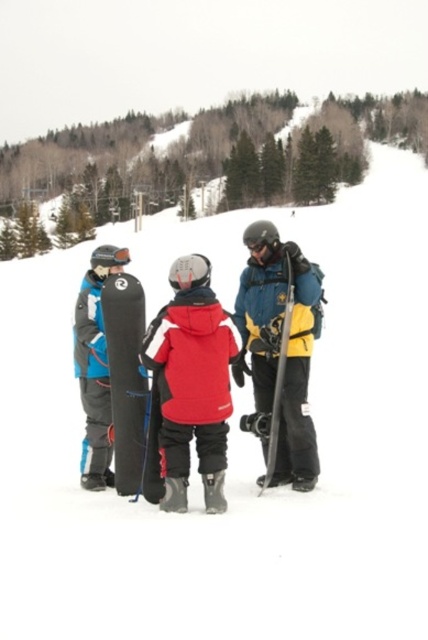
You are a photographer standing at the bottom of the slope. You want to capture a photo of the matte red jacket at center and the black matte snowboard at center. Based on their positions, which object should appear lower in the photo?

The matte red jacket at center is positioned under the black matte snowboard at center, so the matte red jacket at center will appear lower in the photo.

You are a photographer standing on the slope and want to capture both the matte blue snowboard at right and the matte black snowboard at center in a single shot. Which snowboard will appear higher in the photo?

The matte blue snowboard at right will appear higher in the photo because it is located above the matte black snowboard at center.